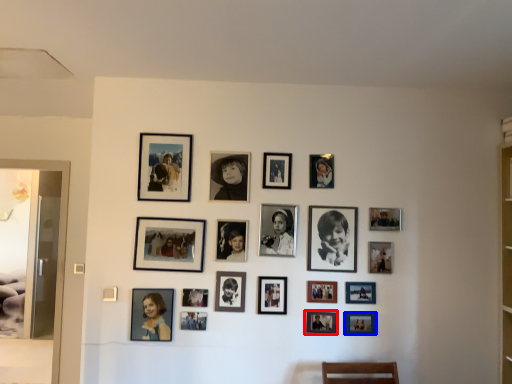
Question: Which of the following is the closest to the observer, picture frame (highlighted by a red box) or picture frame (highlighted by a blue box)?

Choices:
 (A) picture frame
 (B) picture frame

Answer: (A)